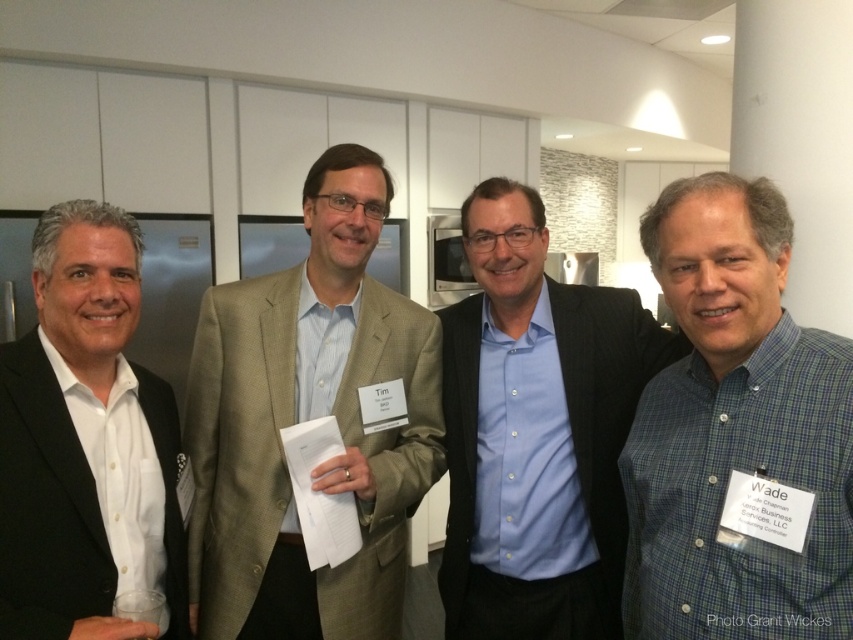
Is point (524, 305) positioned in front of point (36, 467)?

No.

Does blue button-down shirt at center lie in front of black matte suit at left?

No, it is not.

Image resolution: width=853 pixels, height=640 pixels. Find the location of `blue button-down shirt at center`. blue button-down shirt at center is located at coordinates (537, 433).

Is blue plaid shirt at center further to camera compared to blue button-down shirt at center?

No, it is not.

Is point (669, 221) positioned before point (547, 429)?

Yes.

Locate an element on the screen. This screenshot has width=853, height=640. blue plaid shirt at center is located at coordinates (737, 435).

Is blue plaid shirt at center closer to the viewer compared to light brown textured suit at center?

Yes, it is.

Between point (767, 301) and point (221, 352), which one is positioned in front?

Point (767, 301)

You are a GUI agent. You are given a task and a screenshot of the screen. Output one action in this format:
    pyautogui.click(x=<x>, y=<y>)
    Task: Click on the blue plaid shirt at center
    
    Given the screenshot: What is the action you would take?
    pyautogui.click(x=737, y=435)